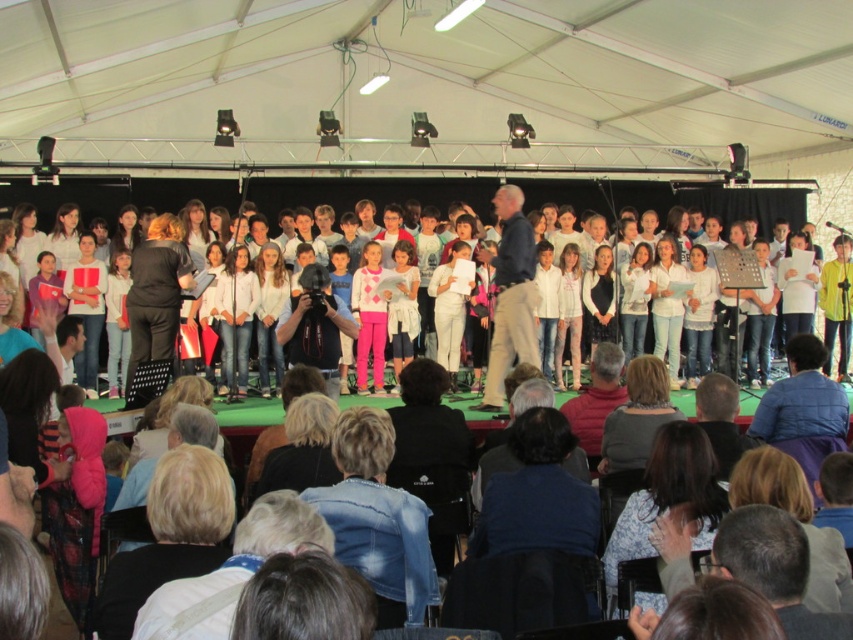
Question: Which point is farther to the camera?

Choices:
 (A) white cotton crowd at center
 (B) denim jacket at lower center

Answer: (A)

Question: Does denim jacket at lower center have a smaller size compared to white cotton crowd at center?

Choices:
 (A) yes
 (B) no

Answer: (B)

Question: Which object appears farthest from the camera in this image?

Choices:
 (A) white cotton crowd at center
 (B) denim jacket at lower center

Answer: (A)

Question: Does denim jacket at lower center have a lesser width compared to white cotton crowd at center?

Choices:
 (A) no
 (B) yes

Answer: (A)

Question: Which point is closer to the camera?

Choices:
 (A) (810, 211)
 (B) (403, 556)

Answer: (B)

Question: Does denim jacket at lower center appear over white cotton crowd at center?

Choices:
 (A) yes
 (B) no

Answer: (A)